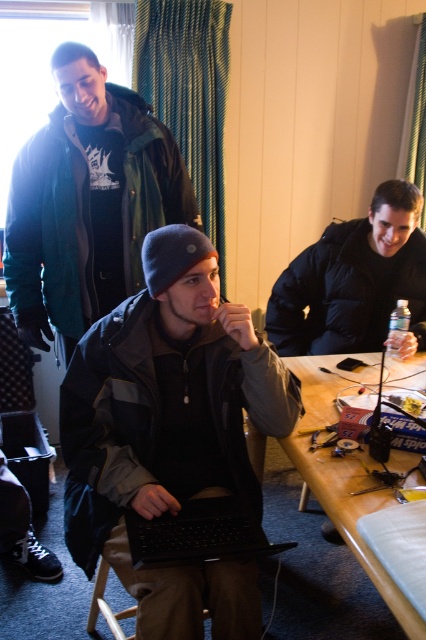
You are a delivery robot that needs to place a small package between the matte black laptop at center and the matte black jacket at upper left. Can you fit the package there if it measures 30 inches in length?

The distance between the matte black laptop at center and the matte black jacket at upper left is 29.58 inches, which is slightly less than the package length of 30 inches. Therefore, the package cannot fit in that space.

You are sitting at the wooden table at center and want to place your black matte laptop at center on the table. Is the laptop closer to you than the table?

The wooden table at center is closer to the viewer than the black matte laptop at center, so the laptop is farther away from you than the table.